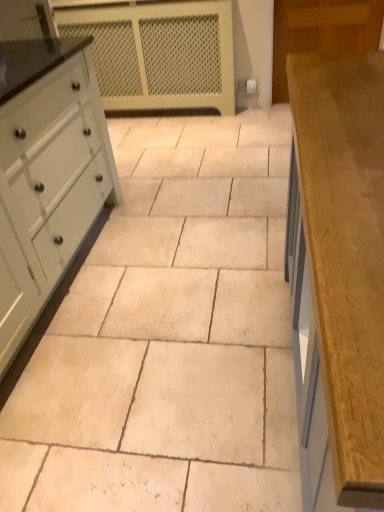
Question: Do you think white painted wood chest of drawers at left is within wooden countertop at right, or outside of it?

Choices:
 (A) inside
 (B) outside

Answer: (B)

Question: Based on their sizes in the image, would you say white painted wood chest of drawers at left is bigger or smaller than wooden countertop at right?

Choices:
 (A) big
 (B) small

Answer: (A)

Question: Which object is the closest to the wooden countertop at right?

Choices:
 (A) beige stone tile at center
 (B) white painted wood chest of drawers at left
 (C) white mesh radiator at upper center

Answer: (A)

Question: Which of these objects is positioned farthest from the wooden countertop at right?

Choices:
 (A) beige stone tile at center
 (B) white painted wood chest of drawers at left
 (C) white mesh radiator at upper center

Answer: (C)